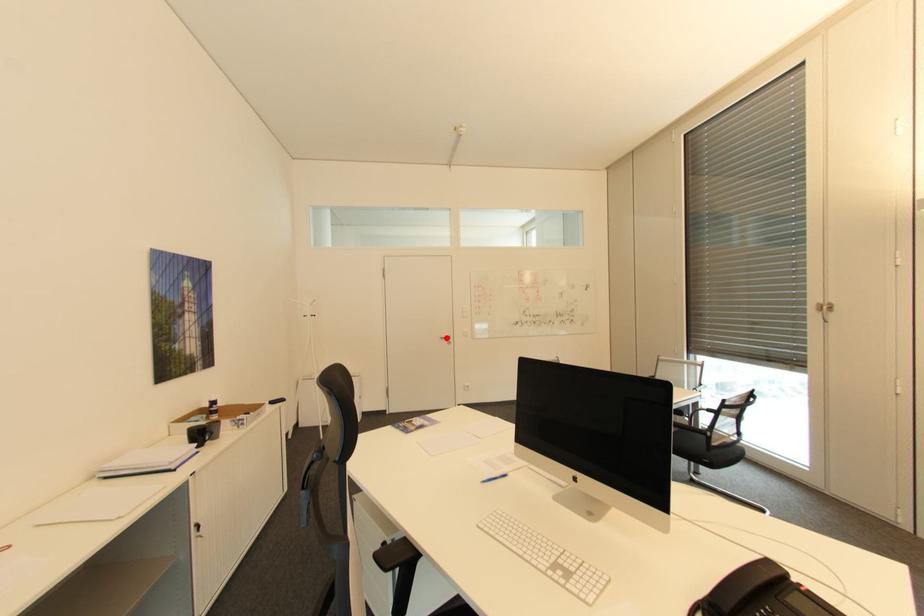
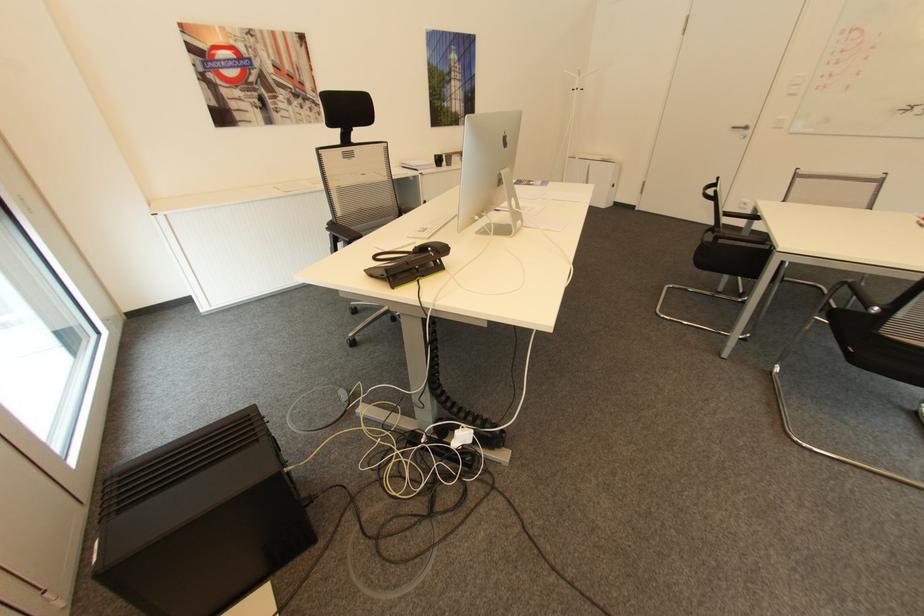
Find the pixel in the second image that matches the highlighted location in the first image.

(736, 128)